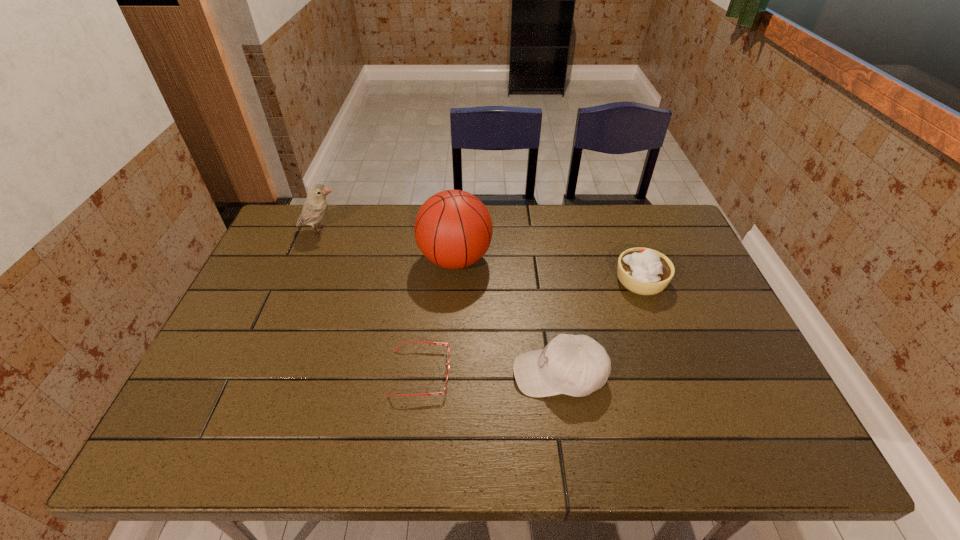
Where is `vacant space at the far right corner`? The height and width of the screenshot is (540, 960). vacant space at the far right corner is located at coordinates (639, 210).

Where is `free space at the near right corner of the desktop`? The width and height of the screenshot is (960, 540). free space at the near right corner of the desktop is located at coordinates 740,432.

This screenshot has width=960, height=540. In order to click on vacant region between the spectacles and the tallest object in this screenshot , I will do `click(438, 316)`.

At what (x,y) coordinates should I click in order to perform the action: click on vacant space that's between the fourth object from left to right and the spectacles. Please return your answer as a coordinate pair (x, y). This screenshot has width=960, height=540. Looking at the image, I should click on (490, 374).

The height and width of the screenshot is (540, 960). In order to click on free space between the bird and the shortest object in this screenshot , I will do `click(371, 302)`.

Locate an element on the screen. This screenshot has width=960, height=540. free area in between the bird and the basketball is located at coordinates (388, 245).

The height and width of the screenshot is (540, 960). I want to click on vacant area between the spectacles and the tallest object, so click(x=438, y=316).

Where is `free space between the whipped cream and the spectacles`? This screenshot has width=960, height=540. free space between the whipped cream and the spectacles is located at coordinates (531, 327).

Locate an element on the screen. Image resolution: width=960 pixels, height=540 pixels. vacant region between the basketball and the farthest object is located at coordinates (388, 245).

Locate an element on the screen. Image resolution: width=960 pixels, height=540 pixels. free area in between the fourth object from left to right and the whipped cream is located at coordinates (600, 327).